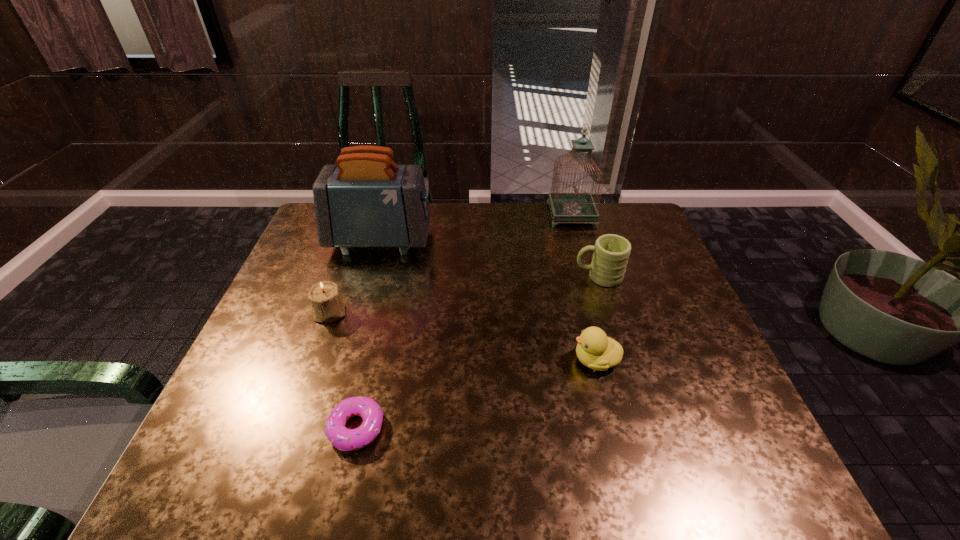
Locate an element on the screen. Image resolution: width=960 pixels, height=540 pixels. birdcage is located at coordinates (576, 207).

At what (x,y) coordinates should I click in order to perform the action: click on toaster. Please return your answer as a coordinate pair (x, y). The image size is (960, 540). Looking at the image, I should click on (364, 201).

Where is `the third farthest object`? The height and width of the screenshot is (540, 960). the third farthest object is located at coordinates (x=611, y=253).

Find the location of a particular element. Image resolution: width=960 pixels, height=540 pixels. the third nearest object is located at coordinates (326, 301).

This screenshot has width=960, height=540. I want to click on the second shortest object, so click(x=595, y=350).

I want to click on the fifth farthest object, so click(595, 350).

This screenshot has width=960, height=540. I want to click on the nearest object, so pyautogui.click(x=341, y=437).

Locate an element on the screen. doughnut is located at coordinates (341, 437).

You are a GUI agent. You are given a task and a screenshot of the screen. Output one action in this format:
    pyautogui.click(x=<x>, y=<y>)
    Task: Click on the vacant region located at the door of the birdcage
    This screenshot has height=540, width=960.
    Given the screenshot: What is the action you would take?
    pyautogui.click(x=512, y=215)

The width and height of the screenshot is (960, 540). Find the location of `vacant space located at the door of the birdcage`. vacant space located at the door of the birdcage is located at coordinates point(454,215).